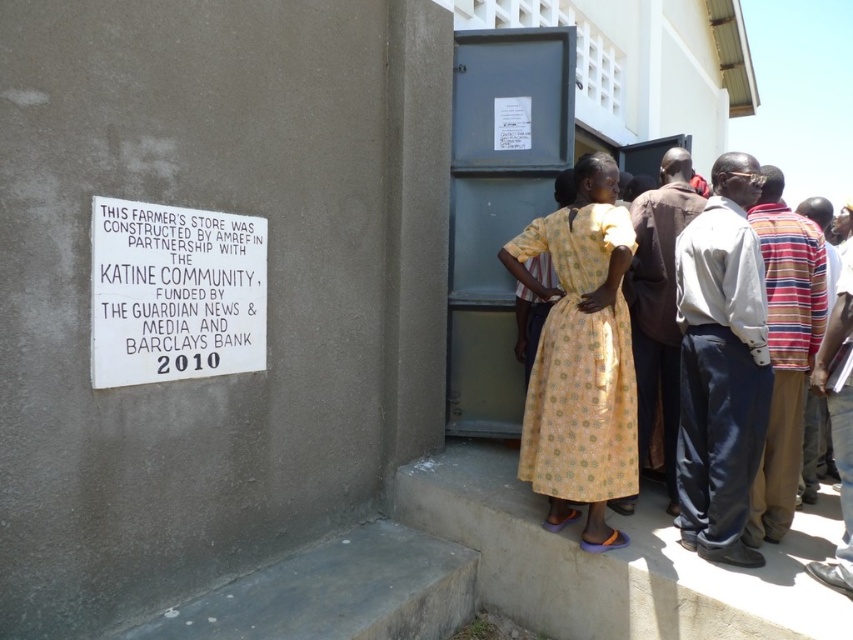
Question: In this image, where is white paper sign at upper left located relative to yellow printed dress at center?

Choices:
 (A) right
 (B) left

Answer: (B)

Question: In this image, where is white paper sign at upper left located relative to yellow printed dress at center?

Choices:
 (A) above
 (B) below

Answer: (A)

Question: Which object appears farthest from the camera in this image?

Choices:
 (A) white paper sign at upper left
 (B) yellow printed dress at center

Answer: (B)

Question: Which object appears farthest from the camera in this image?

Choices:
 (A) yellow printed dress at center
 (B) white paper sign at upper left

Answer: (A)

Question: Can you confirm if white paper sign at upper left is bigger than yellow printed dress at center?

Choices:
 (A) yes
 (B) no

Answer: (B)